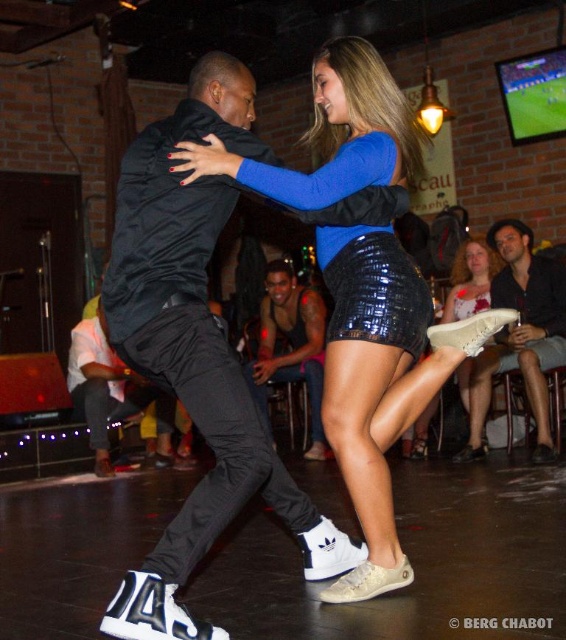
Question: In this image, where is blue shiny skirt at center located relative to black matte pants at center?

Choices:
 (A) right
 (B) left

Answer: (A)

Question: Which of these objects is positioned closest to the white leather shoe at lower right?

Choices:
 (A) white matte shoe at lower center
 (B) white leather sneakers at center
 (C) black leather tank top at center

Answer: (A)

Question: Which point appears farthest from the camera in this image?

Choices:
 (A) (233, 378)
 (B) (344, 112)

Answer: (B)

Question: Can you confirm if blue shiny skirt at center is thinner than white matte shoe at lower center?

Choices:
 (A) no
 (B) yes

Answer: (A)

Question: Which point is farther from the camera taking this photo?

Choices:
 (A) (503, 250)
 (B) (104, 433)
 (C) (448, 298)
 (D) (351, 161)

Answer: (C)

Question: Is white leather sneakers at center positioned at the back of white leather shoe at lower right?

Choices:
 (A) no
 (B) yes

Answer: (A)